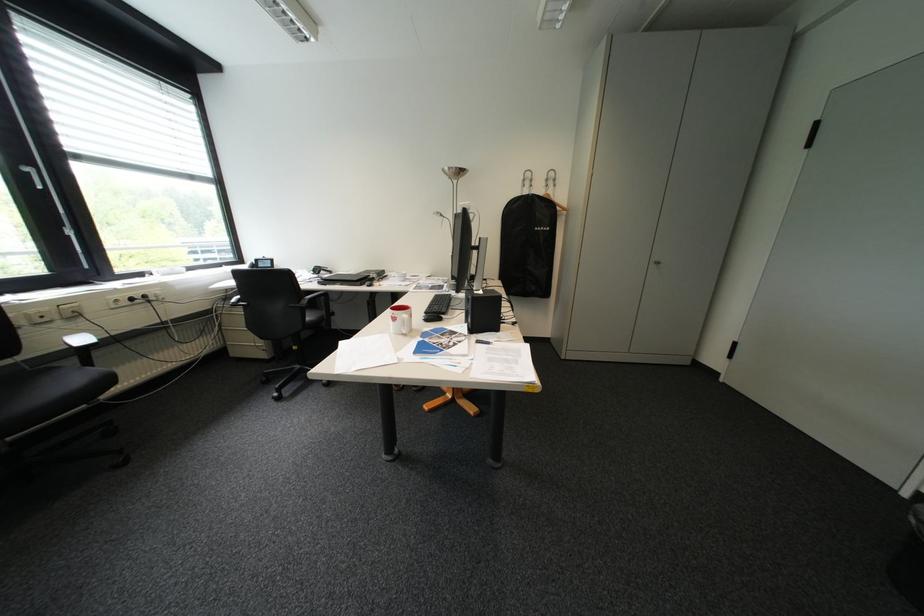
Where would you pull the silver window handle? Please return your answer as a coordinate pair (x, y).

(43, 180)